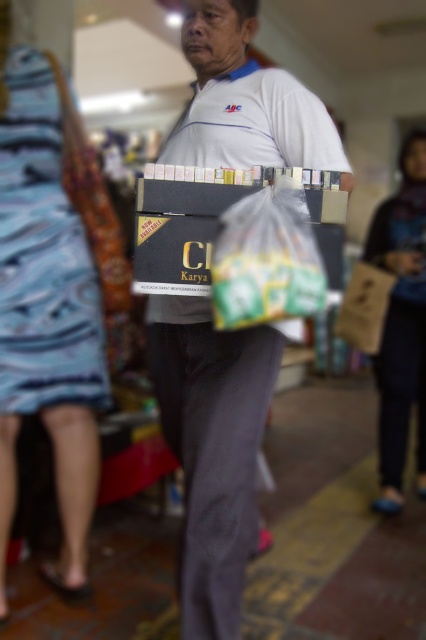
You are a customer in the store and you want to locate the blue patterned dress at lower left. Which direction should you move relative to the white matte box at center?

The blue patterned dress at lower left is to the left of the white matte box at center. So you should move to the left of the white matte box at center to find the blue patterned dress at lower left.

You are a customer in the store and want to pick up both the white matte box at center and the blue fabric bag at lower right. Which item should you reach for first if you want to grab the one that is lower?

The white matte box at center is located below the blue fabric bag at lower right, so you should reach for the white matte box at center first since it is lower.

You are a customer in the store and you see the white matte box at center and the blue patterned dress at lower left. Which object is positioned lower in the image?

The white matte box at center is positioned below the blue patterned dress at lower left, so it is lower in the image.